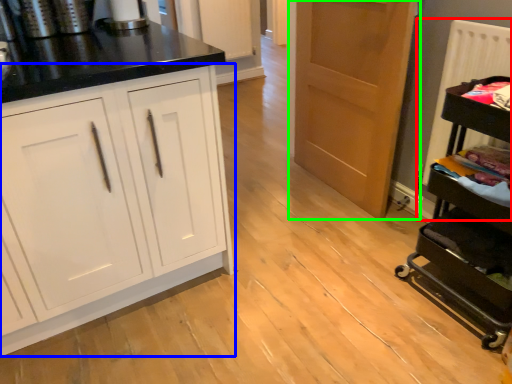
Question: Which object is the farthest from radiator (highlighted by a red box)? Choose among these: cabinetry (highlighted by a blue box) or door (highlighted by a green box).

Choices:
 (A) cabinetry
 (B) door

Answer: (A)